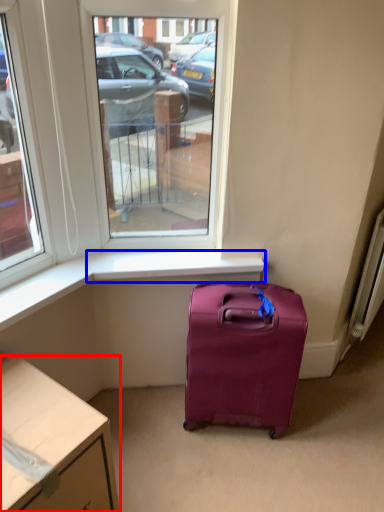
Question: Which point is further to the camera, desk (highlighted by a red box) or window sill (highlighted by a blue box)?

Choices:
 (A) desk
 (B) window sill

Answer: (B)